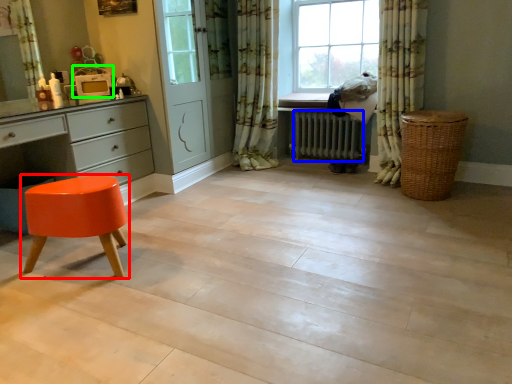
Question: Based on their relative distances, which object is nearer to stool (highlighted by a red box)? Choose from radiator (highlighted by a blue box) and appliance (highlighted by a green box).

Choices:
 (A) radiator
 (B) appliance

Answer: (B)